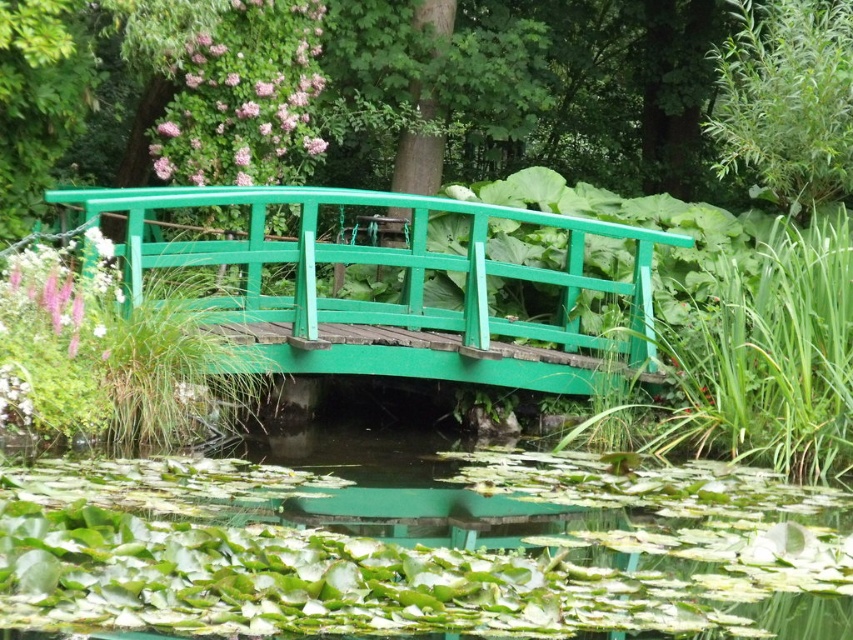
You are standing at the edge of the garden pond and want to reach a specific point marked at coordinates point [786,497]. If your current distance from the bridge is 5 meters, can you estimate whether the marked point is closer to you or the bridge?

The distance of point [786,497] from viewer is 10.47 meters. Since you are 5 meters away from the bridge, the marked point is farther from you than the bridge.

Consider the image. You are a gardener who wants to place a new decorative statue on the green lily pads at center. However, you need to ensure that the statue won not block the view of the green wooden bridge at center from the pond area. Can you place the statue there?

The green lily pads at center are smaller than the green wooden bridge at center. Since the lily pads are smaller, placing a statue on them might block the view of the larger bridge. Therefore, it is not advisable to place the statue there.

You are a gardener standing on the green wooden bridge at center. You want to place a small statue on the green lily pads at center. Can you see the statue from your current position on the bridge?

The green lily pads at center has a lesser height compared to green wooden bridge at center. Since the lily pads are lower, you should be able to see the statue placed on them from the bridge.